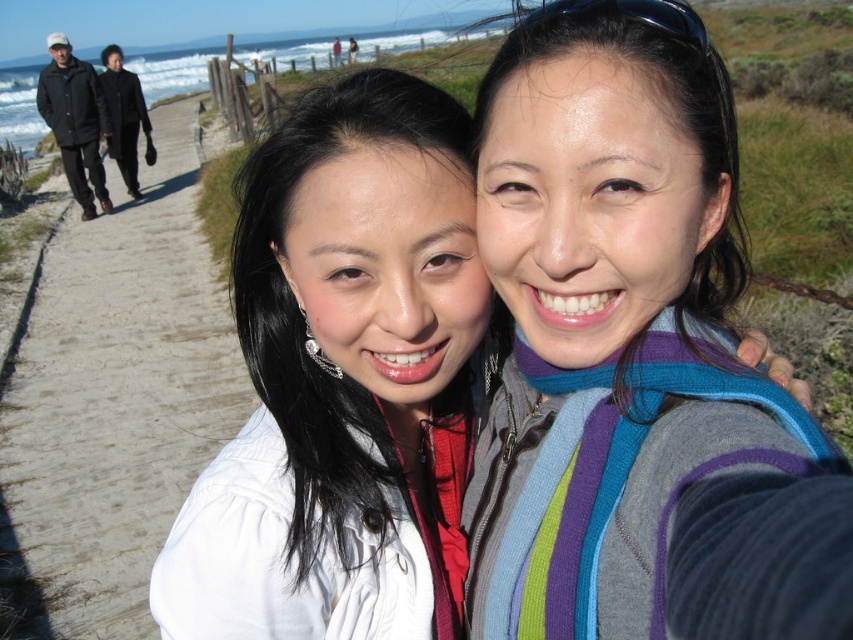
Question: Which of the following is the closest to the observer?

Choices:
 (A) brown dirt path at center
 (B) black matte jacket at upper left

Answer: (A)

Question: Is brown dirt path at center bigger than black matte jacket at upper left?

Choices:
 (A) no
 (B) yes

Answer: (B)

Question: Is brown dirt path at center thinner than black matte jacket at upper left?

Choices:
 (A) yes
 (B) no

Answer: (B)

Question: Is white matte jacket at center above black matte jacket at upper left?

Choices:
 (A) no
 (B) yes

Answer: (A)

Question: Which of the following is the closest to the observer?

Choices:
 (A) (44, 88)
 (B) (53, 547)
 (C) (318, 209)

Answer: (C)

Question: Considering the real-world distances, which object is closest to the white matte jacket at center?

Choices:
 (A) black matte jacket at upper left
 (B) brown dirt path at center

Answer: (B)